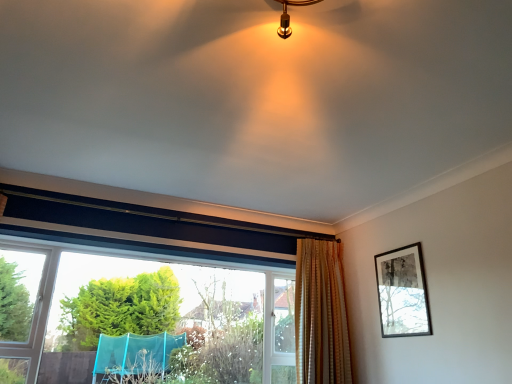
Where is `gold textured curtain at center`? This screenshot has width=512, height=384. gold textured curtain at center is located at coordinates (321, 315).

What are the coordinates of `black matte picture frame at upper right` in the screenshot? It's located at tap(402, 292).

Identify the location of gold textured curtain at center. (321, 315).

From the image's perspective, would you say black matte picture frame at upper right is positioned over gold textured curtain at center?

Yes, from the image's perspective, black matte picture frame at upper right is on top of gold textured curtain at center.

Is black matte picture frame at upper right oriented towards gold textured curtain at center?

No.

From a real-world perspective, between black matte picture frame at upper right and gold textured curtain at center, who is vertically higher?

In real-world perspective, black matte picture frame at upper right is above.

Is gold textured curtain at center wider than black matte picture frame at upper right?

Correct, the width of gold textured curtain at center exceeds that of black matte picture frame at upper right.

Is gold textured curtain at center bigger or smaller than black matte picture frame at upper right?

Clearly, gold textured curtain at center is larger in size than black matte picture frame at upper right.

The width and height of the screenshot is (512, 384). I want to click on curtain beneath the black matte picture frame at upper right (from a real-world perspective), so tap(321, 315).

Considering the sizes of gold textured curtain at center and black matte picture frame at upper right in the image, is gold textured curtain at center taller or shorter than black matte picture frame at upper right?

In the image, gold textured curtain at center appears to be taller than black matte picture frame at upper right.

From a real-world perspective, is clear glass window at lower left positioned under gold textured curtain at center based on gravity?

Yes, from a real-world perspective, clear glass window at lower left is beneath gold textured curtain at center.

From the image's perspective, is clear glass window at lower left above gold textured curtain at center?

No, from the image's perspective, clear glass window at lower left is not above gold textured curtain at center.

Is gold textured curtain at center inside clear glass window at lower left?

No, gold textured curtain at center is not surrounded by clear glass window at lower left.

Measure the distance between clear glass window at lower left and gold textured curtain at center.

They are 34.06 inches apart.

Is black matte picture frame at upper right oriented towards clear glass window at lower left?

No, black matte picture frame at upper right does not turn towards clear glass window at lower left.

From the image's perspective, which is below, black matte picture frame at upper right or clear glass window at lower left?

From the image's view, clear glass window at lower left is below.

How different are the orientations of black matte picture frame at upper right and clear glass window at lower left in degrees?

87.6 degrees.

Between black matte picture frame at upper right and clear glass window at lower left, which one has less height?

black matte picture frame at upper right.

Is clear glass window at lower left not near black matte picture frame at upper right?

Indeed, clear glass window at lower left is not near black matte picture frame at upper right.

From a real-world perspective, which object stands above the other?

black matte picture frame at upper right, from a real-world perspective.

Locate an element on the screen. picture frame above the clear glass window at lower left (from the image's perspective) is located at coordinates (402, 292).

Is clear glass window at lower left spatially inside black matte picture frame at upper right, or outside of it?

clear glass window at lower left is spatially situated outside black matte picture frame at upper right.

Can you confirm if gold textured curtain at center is bigger than clear glass window at lower left?

Actually, gold textured curtain at center might be smaller than clear glass window at lower left.

Considering the relative sizes of gold textured curtain at center and clear glass window at lower left in the image provided, is gold textured curtain at center shorter than clear glass window at lower left?

In fact, gold textured curtain at center may be taller than clear glass window at lower left.

Consider the image. Which is in front, gold textured curtain at center or clear glass window at lower left?

Positioned in front is clear glass window at lower left.

You are a GUI agent. You are given a task and a screenshot of the screen. Output one action in this format:
    pyautogui.click(x=<x>, y=<y>)
    Task: Click on the curtain on the left of the black matte picture frame at upper right
    
    Given the screenshot: What is the action you would take?
    pyautogui.click(x=321, y=315)

Locate an element on the screen. picture frame that is on the right side of gold textured curtain at center is located at coordinates (402, 292).

Considering their positions, is black matte picture frame at upper right positioned further to gold textured curtain at center than clear glass window at lower left?

Based on the image, clear glass window at lower left appears to be further to gold textured curtain at center.

When comparing their distances from clear glass window at lower left, does black matte picture frame at upper right or gold textured curtain at center seem closer?

gold textured curtain at center lies closer to clear glass window at lower left than the other object.

Based on their spatial positions, is gold textured curtain at center or black matte picture frame at upper right closer to clear glass window at lower left?

Among the two, gold textured curtain at center is located nearer to clear glass window at lower left.

Which object lies further to the anchor point black matte picture frame at upper right, gold textured curtain at center or clear glass window at lower left?

clear glass window at lower left is positioned further to the anchor black matte picture frame at upper right.

Based on their spatial positions, is clear glass window at lower left or gold textured curtain at center closer to black matte picture frame at upper right?

gold textured curtain at center is positioned closer to the anchor black matte picture frame at upper right.

When comparing their distances from gold textured curtain at center, does clear glass window at lower left or black matte picture frame at upper right seem closer?

black matte picture frame at upper right.

Locate an element on the screen. curtain between clear glass window at lower left and black matte picture frame at upper right is located at coordinates (321, 315).